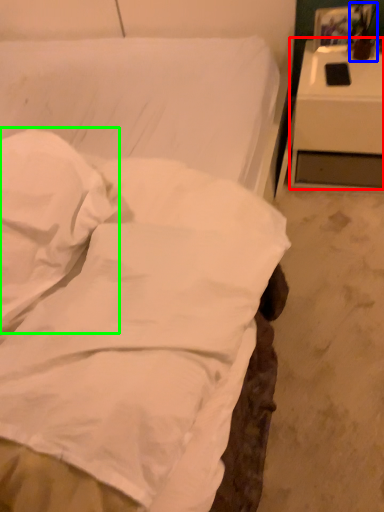
Question: Estimate the real-world distances between objects in this image. Which object is farther from nightstand (highlighted by a red box), table lamp (highlighted by a blue box) or pillow (highlighted by a green box)?

Choices:
 (A) table lamp
 (B) pillow

Answer: (B)